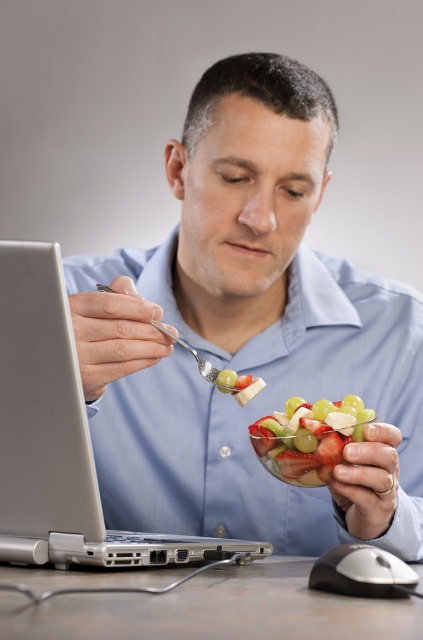
Question: Based on their relative distances, which object is nearer to the black plastic mouse at lower right?

Choices:
 (A) brown wooden table at lower center
 (B) translucent glass bowl of fruit salad at center

Answer: (A)

Question: Is blue matte shirt at center wider than silver metallic laptop at left?

Choices:
 (A) yes
 (B) no

Answer: (A)

Question: Does blue matte shirt at center appear under brown wooden table at lower center?

Choices:
 (A) yes
 (B) no

Answer: (B)

Question: Can you confirm if brown wooden table at lower center is wider than black plastic mouse at lower right?

Choices:
 (A) yes
 (B) no

Answer: (A)

Question: Which point is farther to the camera?

Choices:
 (A) silver metallic laptop at left
 (B) translucent glass bowl of fruit salad at center
 (C) blue matte shirt at center

Answer: (B)

Question: Which of these objects is positioned closest to the blue matte shirt at center?

Choices:
 (A) black plastic mouse at lower right
 (B) silver metallic spoon at center
 (C) translucent glass bowl of fruit salad at center
 (D) brown wooden table at lower center

Answer: (C)